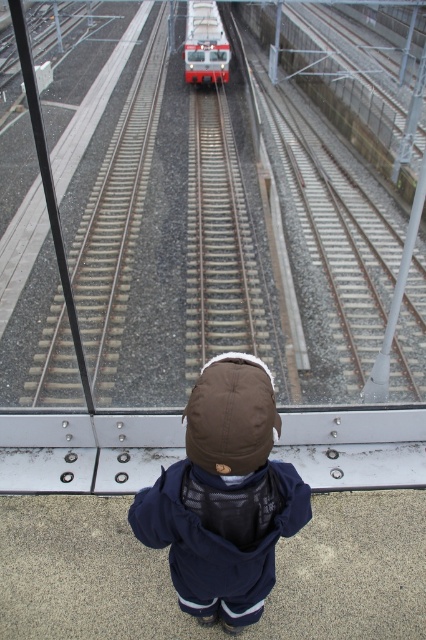
You are a photographer trying to capture the scene from above. You notice the brown fleece jacket at center and the red glossy train at center. Which object appears narrower in the photo?

The brown fleece jacket at center appears narrower than the red glossy train at center in the photo.

You are a safety inspector checking the platform. You see the brown fleece jacket at center and the red glossy train at center. Which object is closer to you as you stand on the platform?

The brown fleece jacket at center is closer to you than the red glossy train at center.

You are a safety inspector checking the platform. The brown fleece jacket at center is an object of interest. According to the coordinates provided, is the jacket closer to the edge of the platform near the tracks or the safer area away from the tracks?

The brown fleece jacket at center is located at point (224, 496). Since the coordinates suggest it is closer to the edge near the tracks, the jacket is positioned near the dangerous area. Safety measures should be taken to ensure the child moves away from the edge.